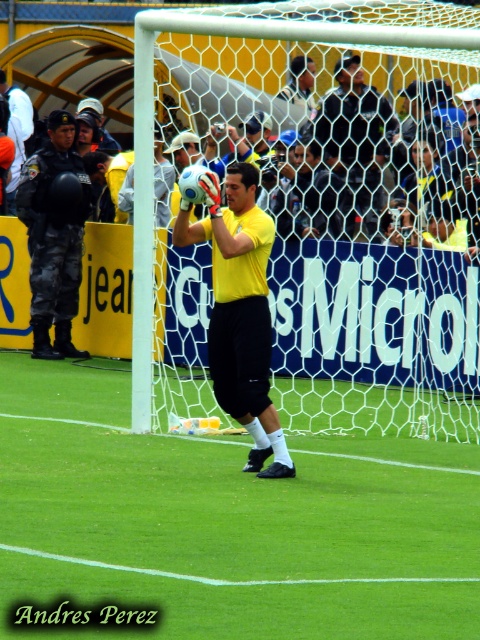
Is yellow matte jersey at center positioned at the back of yellow matte shirt at center?

No, yellow matte jersey at center is closer to the viewer.

Who is positioned more to the left, yellow matte jersey at center or yellow matte shirt at center?

From the viewer's perspective, yellow matte jersey at center appears more on the left side.

Identify the location of yellow matte jersey at center. (240, 310).

This screenshot has width=480, height=640. Identify the location of yellow matte jersey at center. 240,310.

Does point (460, 307) lie in front of point (362, 145)?

Yes, it is in front of point (362, 145).

Is white mesh net at center below yellow matte shirt at center?

Yes, white mesh net at center is below yellow matte shirt at center.

Find the location of a particular element. white mesh net at center is located at coordinates [x=323, y=220].

Who is shorter, white mesh net at center or yellow matte jersey at center?

yellow matte jersey at center

Is white mesh net at center positioned at the back of yellow matte jersey at center?

Yes, white mesh net at center is further from the viewer.

The height and width of the screenshot is (640, 480). Describe the element at coordinates (323, 220) in the screenshot. I see `white mesh net at center` at that location.

Where is `white mesh net at center`? white mesh net at center is located at coordinates (323, 220).